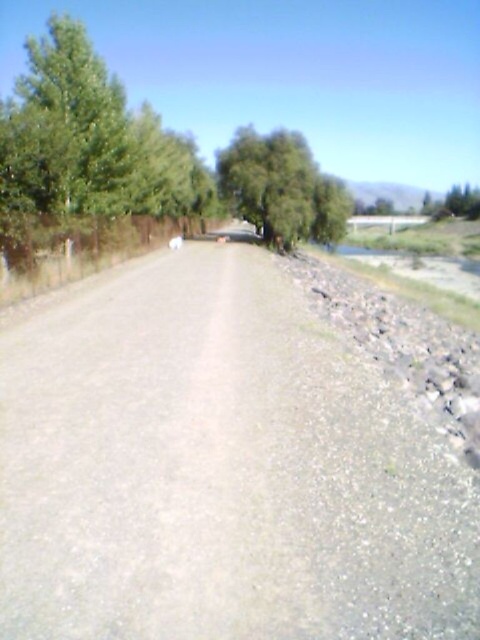
Question: Is gray gravel dirt track at center to the right of green leafy tree at center from the viewer's perspective?

Choices:
 (A) no
 (B) yes

Answer: (A)

Question: Which point is closer to the camera taking this photo?

Choices:
 (A) (472, 497)
 (B) (265, 234)

Answer: (A)

Question: Does gray gravel dirt track at center have a larger size compared to green leafy tree at center?

Choices:
 (A) yes
 (B) no

Answer: (B)

Question: Which point appears closest to the camera in this image?

Choices:
 (A) (299, 195)
 (B) (9, 429)

Answer: (B)

Question: Is gray gravel dirt track at center wider than green leafy tree at center?

Choices:
 (A) yes
 (B) no

Answer: (B)

Question: Which of the following is the closest to the observer?

Choices:
 (A) (276, 211)
 (B) (194, 545)

Answer: (B)